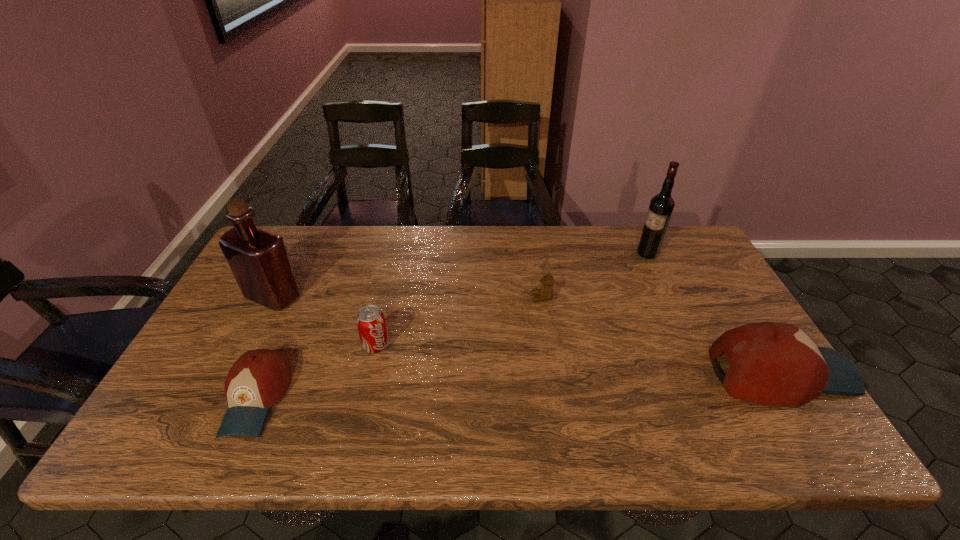
At what (x,y) coordinates should I click in order to perform the action: click on wine bottle that is at the right edge. Please return your answer as a coordinate pair (x, y). The height and width of the screenshot is (540, 960). Looking at the image, I should click on (661, 207).

At what (x,y) coordinates should I click in order to perform the action: click on object positioned at the near left corner. Please return your answer as a coordinate pair (x, y). Image resolution: width=960 pixels, height=540 pixels. Looking at the image, I should click on (259, 378).

I want to click on object located at the far right corner, so click(661, 207).

Find the location of a particular element. object situated at the near right corner is located at coordinates (775, 364).

Locate an element on the screen. The image size is (960, 540). blank space at the far edge of the desktop is located at coordinates (611, 266).

In the image, there is a desktop. What are the coordinates of `vacant space at the near edge` in the screenshot? It's located at point(692,394).

This screenshot has height=540, width=960. Find the location of `free space at the right edge of the desktop`. free space at the right edge of the desktop is located at coordinates (720, 312).

Locate an element on the screen. The height and width of the screenshot is (540, 960). free location at the near left corner of the desktop is located at coordinates (179, 397).

In the image, there is a desktop. Where is `vacant space at the far right corner`? The width and height of the screenshot is (960, 540). vacant space at the far right corner is located at coordinates (679, 239).

Locate an element on the screen. This screenshot has height=540, width=960. free spot between the fourth object from right to left and the shorter baseball cap is located at coordinates pyautogui.click(x=317, y=372).